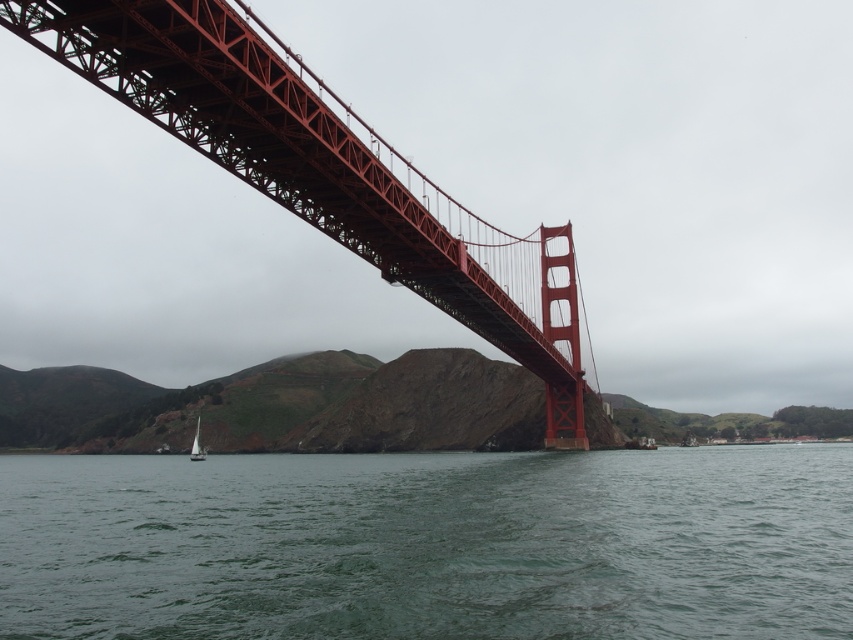
You are a photographer planning to capture the Golden Gate Bridge from this vantage point. You want to ensure that the green water at lower center and the red steel suspension bridge at upper center are both visible in your shot. Given their widths, which object should you frame first to accommodate their sizes?

The green water at lower center is wider than the red steel suspension bridge at upper center. To accommodate their sizes, you should frame the green water at lower center first since it requires more space in the composition.

You are standing on the shore and looking at the green water at lower center and the red steel suspension bridge at upper center. Which object is closer to you?

The green water at lower center is closer to the viewer than the red steel suspension bridge at upper center.